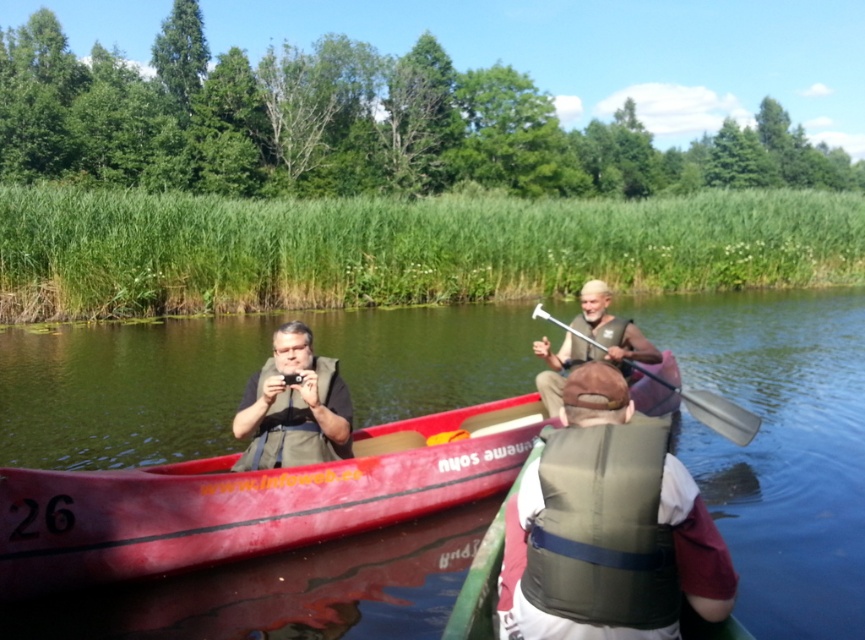
Please describe the location of the point with coordinates (238, 378) in the scene. What object or feature is located there?

The point at coordinates (238, 378) is located on the green smooth water at center.

In the serene outdoor scene with three individuals canoeing on a calm body of water, there is a red canoe with the number 26 and the website www.infoweb.co printed on its side. Two people are in the canoe. One is at the front wearing a life vest and holding a camera, while the other is at the back. There is a point marked at coordinates (614, 531). Which object does this point correspond to?

The point at coordinates (614, 531) corresponds to the green fabric life vest at center.

Based on the photo, you are planning to place a small floating toy in the middle of the green smooth water at center. Considering the size of the matte brown vest at center, will the toy fit without touching it?

The green smooth water at center is wider than the matte brown vest at center, so the toy should fit without touching it.